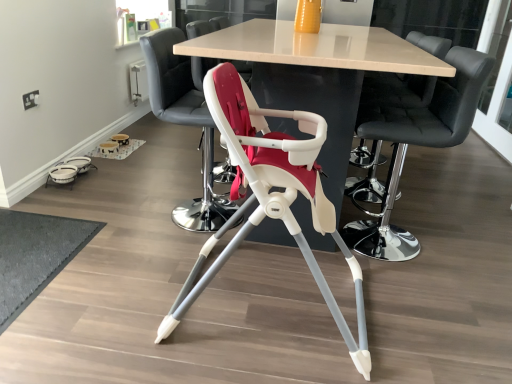
The width and height of the screenshot is (512, 384). I want to click on vacant area on the back side of white plastic highchair at center, positioned as the first chair in left-to-right order, so click(x=181, y=178).